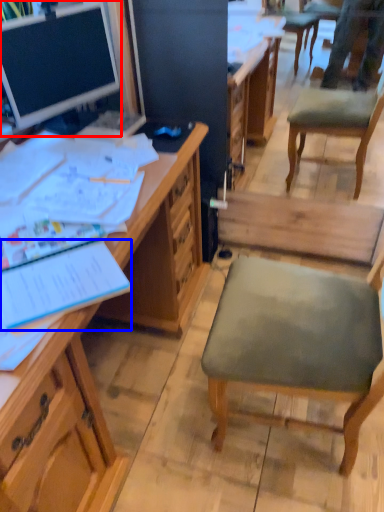
Question: Among these objects, which one is farthest to the camera, desk (highlighted by a red box) or notebook (highlighted by a blue box)?

Choices:
 (A) desk
 (B) notebook

Answer: (A)